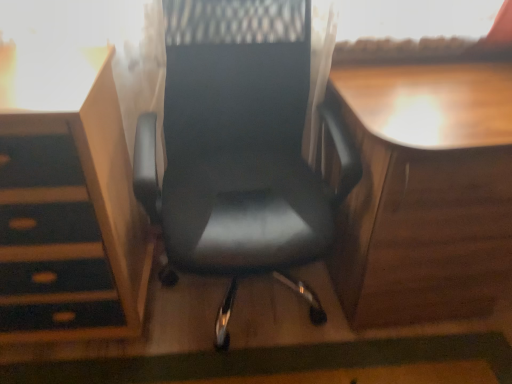
Question: From a real-world perspective, is matte wood vanity at left physically located above or below wooden desk at right?

Choices:
 (A) above
 (B) below

Answer: (A)

Question: Considering the positions of matte wood vanity at left and wooden desk at right in the image, is matte wood vanity at left wider or thinner than wooden desk at right?

Choices:
 (A) thin
 (B) wide

Answer: (A)

Question: Estimate the real-world distances between objects in this image. Which object is closer to the black leather chair at center?

Choices:
 (A) matte wood vanity at left
 (B) wooden desk at right

Answer: (A)

Question: Based on their relative distances, which object is farther from the black leather chair at center?

Choices:
 (A) matte wood vanity at left
 (B) wooden desk at right

Answer: (B)